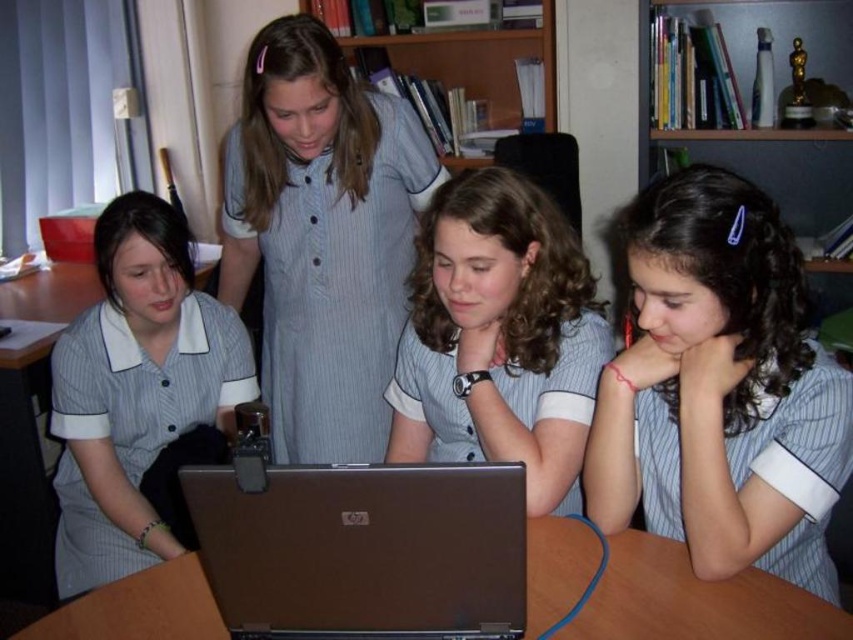
You are a student who needs to place a 10 inch wide textbook on the brown wooden table at center. Based on the space between the matte gray uniform at center and the table, will the textbook fit without overlapping the uniform?

The distance between the matte gray uniform at center and the brown wooden table at center is 9.50 inches. Since the textbook is 10 inches wide, it will overlap the uniform when placed on the table.

You are a student who needs to reach the silver metallic laptop at center to retrieve a USB drive. The brown wooden table at center is in your way. Can you easily access the laptop without moving the table?

The silver metallic laptop at center is closer to the viewer than the brown wooden table at center, so you can easily access the laptop without needing to move the table since it is already in front of the table.

You are a photographer trying to capture a group photo of the matte gray uniform at center and the brown wooden table at center. If you want to ensure both subjects are in focus, which one should you adjust the camera focus on first?

The matte gray uniform at center is bigger than the brown wooden table at center, so you should focus on the matte gray uniform at center first to ensure proper sharpness for the larger subject.